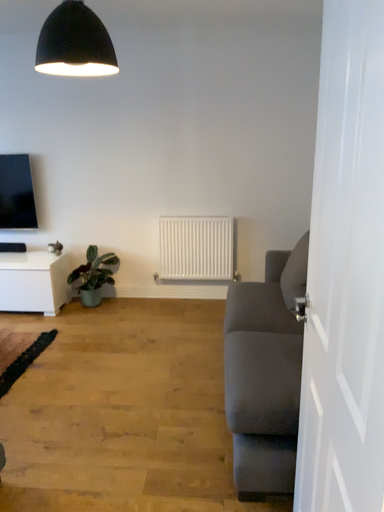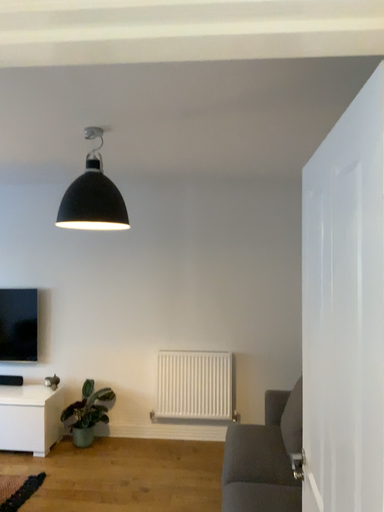
Question: Which way did the camera rotate in the video?

Choices:
 (A) rotated downward
 (B) rotated upward

Answer: (B)